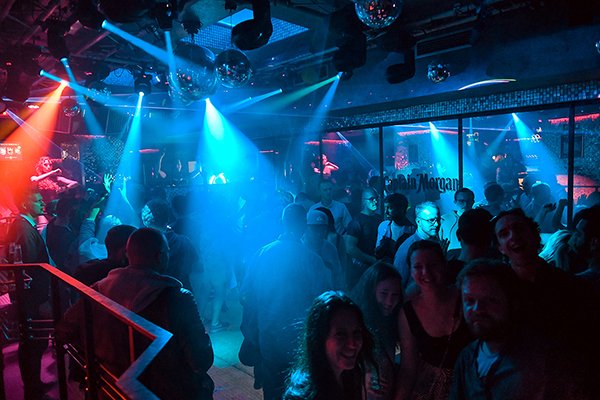
Locate an element on the screen. This screenshot has height=400, width=600. floor is located at coordinates (236, 385).